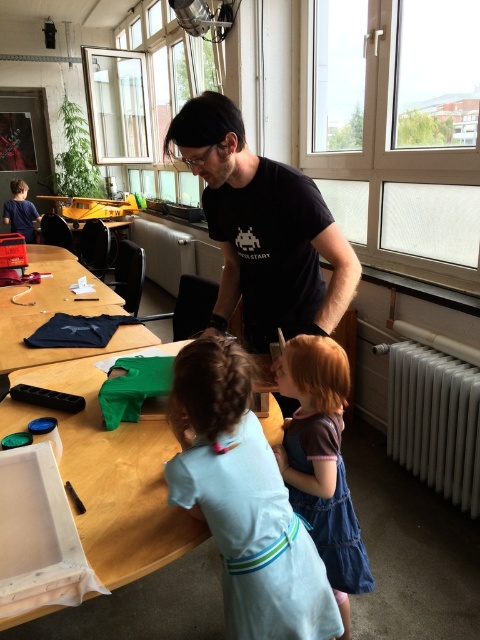
Question: Considering the real-world distances, which object is closest to the wooden table at center?

Choices:
 (A) white metallic radiator at lower right
 (B) black matte t-shirt at center

Answer: (B)

Question: Can you confirm if wooden table at center is positioned to the left of white metallic radiator at lower right?

Choices:
 (A) yes
 (B) no

Answer: (A)

Question: Is denim dress at center thinner than matte black t-shirt at center?

Choices:
 (A) no
 (B) yes

Answer: (B)

Question: Among these objects, which one is farthest from the camera?

Choices:
 (A) light blue fabric at center
 (B) matte black t-shirt at center

Answer: (B)

Question: Which object is farther from the camera taking this photo?

Choices:
 (A) white metallic radiator at lower right
 (B) denim dress at center
 (C) matte black t-shirt at center

Answer: (A)

Question: Can you confirm if black matte t-shirt at center is smaller than denim dress at center?

Choices:
 (A) no
 (B) yes

Answer: (A)